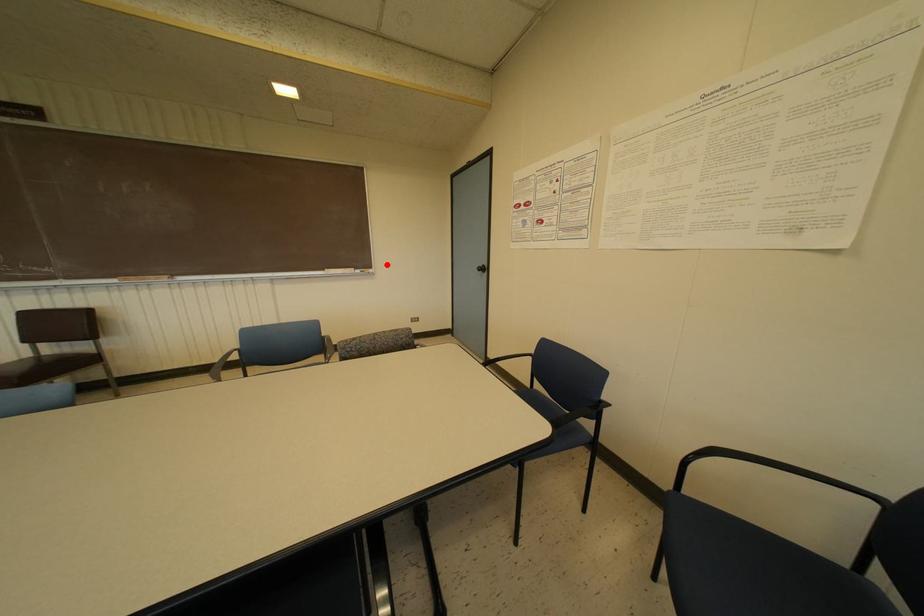
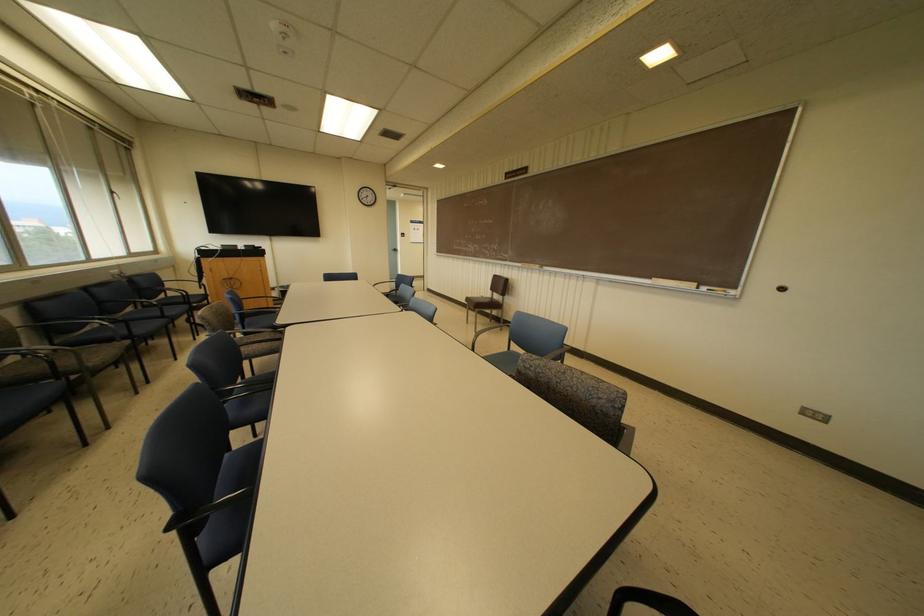
The point at the highlighted location is marked in the first image. Where is the corresponding point in the second image?

(783, 288)